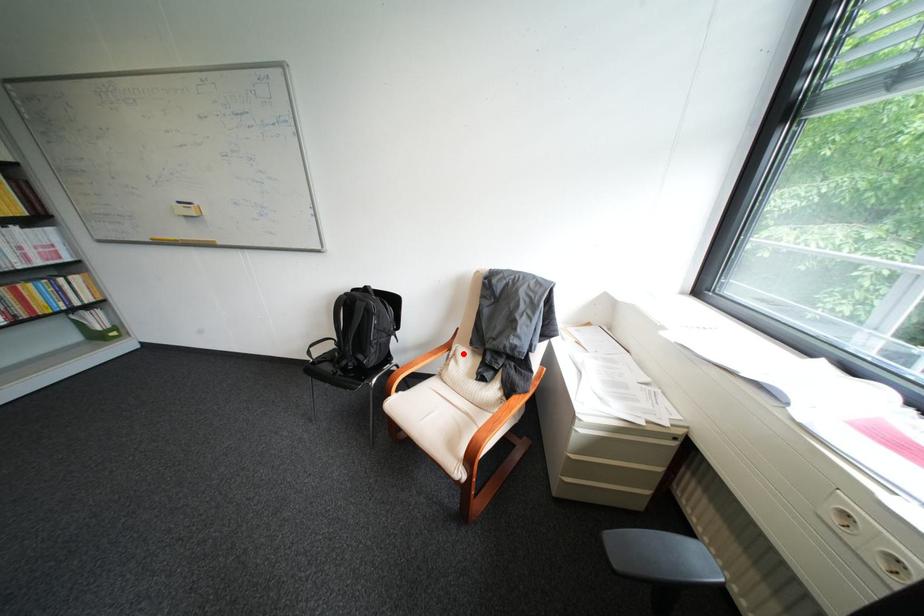
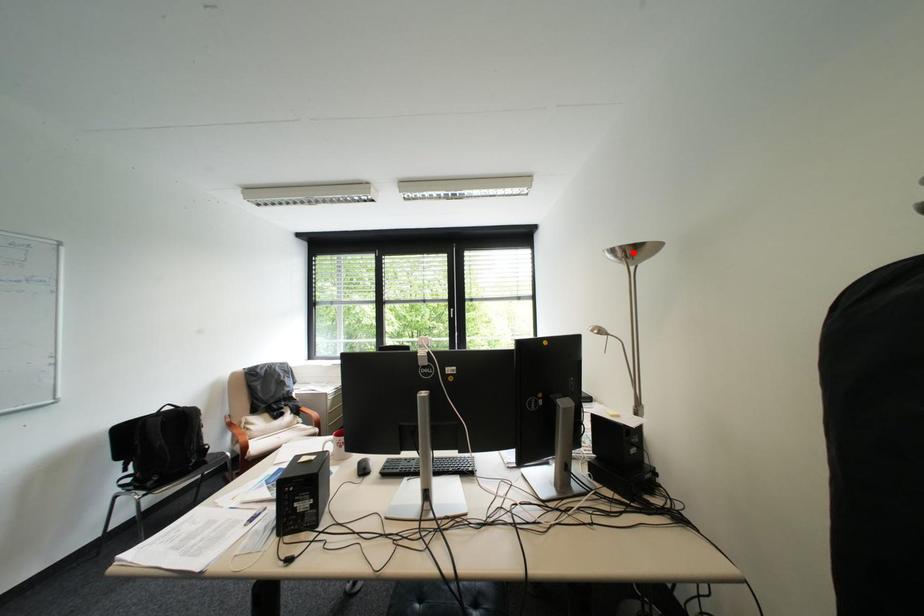
I am providing you with two images of the same scene from different viewpoints. A red point is marked on the first image and another point is marked on the second image. Do the highlighted points in image1 and image2 indicate the same real-world spot?

No